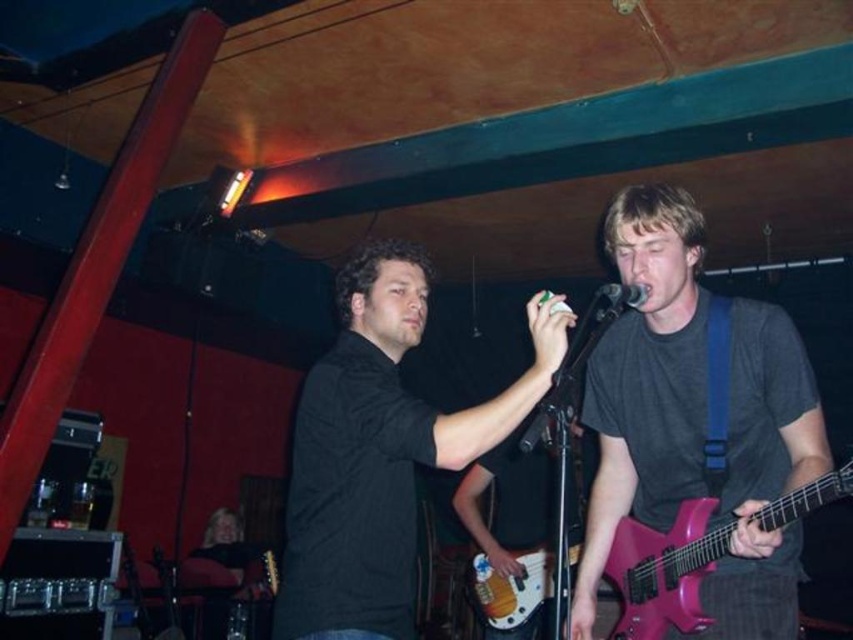
You are standing at the point marked as point (746, 416) and want to walk to the stage. The stage is 2 meters away from your current position. Can you reach the stage without moving further than 2 meters?

The distance to the stage from point (746, 416) is 1.91 meters, which is within the 2 meters limit. Yes, you can reach the stage without moving further than 2 meters.

Looking at this image, you are a stagehand who needs to move both the matte pink electric guitar at right and the matte black guitar at center off the stage. Based on the space they occupy, which guitar will require more effort to maneuver around due to its size?

The matte black guitar at center requires more effort to maneuver around because it occupies more space than the matte pink electric guitar at right.

You are a photographer setting up for a live music shoot. You need to position a light so it illuminates both the matte pink electric guitar at right and the matte black guitar at center without casting shadows on the performers. Based on their positions, which guitar should the light be placed closer to?

The matte pink electric guitar at right is in front of the matte black guitar at center, so the light should be placed closer to the matte black guitar at center to avoid shadows on the performers in front.